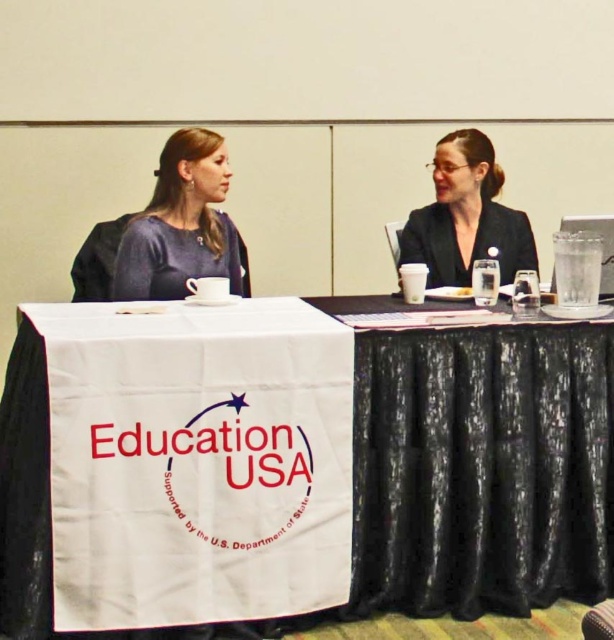
You are standing at the entrance of the room where the image is taken. You need to locate the white fabric table at center. According to the coordinates provided, in which direction should you move relative to your current position to reach it?

The white fabric table at center is located at coordinates point (478, 472). Since the coordinate system typically has the origin at the bottom left corner, moving towards the upper right direction from the entrance would lead you to the table.

You are organizing a small event and need to determine if the matte blue dress at center will fit on the white fabric table at center. Can you confirm based on their sizes?

The white fabric table at center is wider than the matte blue dress at center, so the dress will fit on the table.